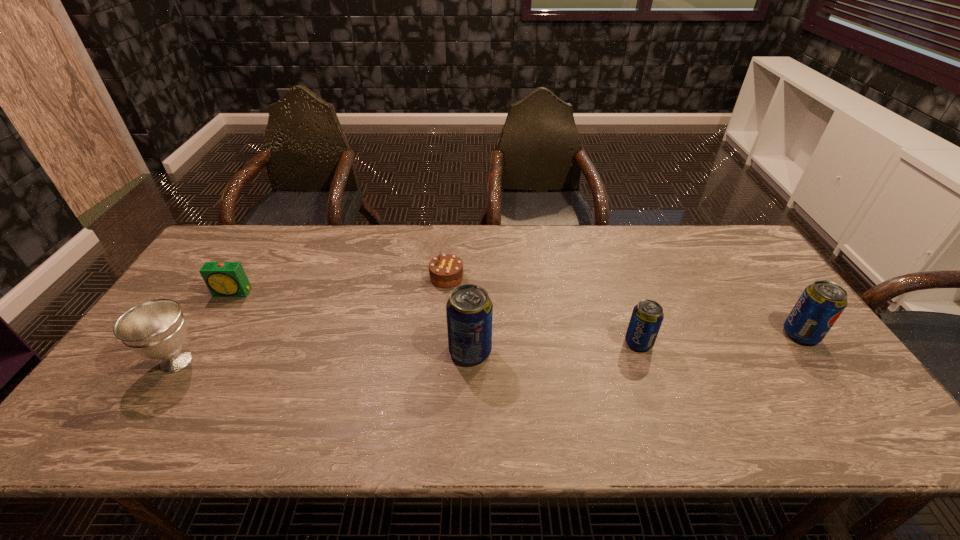
Locate an element on the screen. vacant space in between the third shortest object and the tallest object is located at coordinates (555, 347).

What are the coordinates of `empty location between the leftmost soda and the third shortest object` in the screenshot? It's located at (555, 347).

This screenshot has height=540, width=960. In order to click on vacant area between the fifth tallest object and the leftmost soda in this screenshot , I will do `click(351, 322)`.

At what (x,y) coordinates should I click in order to perform the action: click on empty space that is in between the chocolate cake and the fifth object from left to right. Please return your answer as a coordinate pair (x, y). This screenshot has height=540, width=960. Looking at the image, I should click on (542, 310).

I want to click on unoccupied position between the rightmost object and the shortest soda, so click(720, 338).

I want to click on free space between the second shortest soda and the second shortest object, so click(x=516, y=313).

Locate an element on the screen. The height and width of the screenshot is (540, 960). object that is the second closest one to the leftmost soda is located at coordinates (647, 316).

The width and height of the screenshot is (960, 540). In order to click on object that is the fifth nearest to the rightmost object in this screenshot , I will do point(156,329).

Select which soda appears as the second closest to the chalice. Please provide its 2D coordinates. Your answer should be formatted as a tuple, i.e. [(x, y)], where the tuple contains the x and y coordinates of a point satisfying the conditions above.

[(647, 316)]

Locate an element on the screen. This screenshot has width=960, height=540. soda that stands as the closest to the shortest soda is located at coordinates (469, 310).